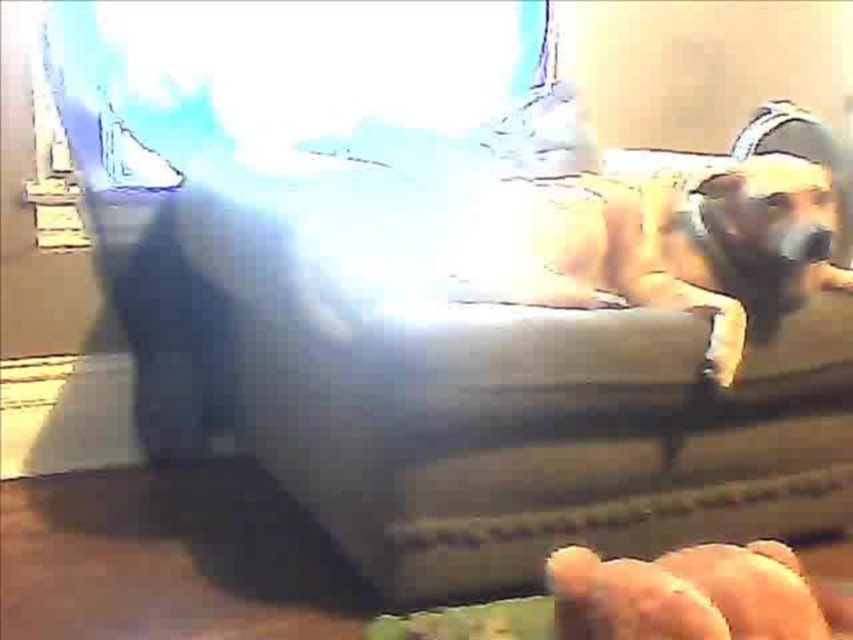
Between furry beige dog at center and smooth leather hand at lower right, which one appears on the right side from the viewer's perspective?

Positioned to the right is furry beige dog at center.

Which is above, furry beige dog at center or smooth leather hand at lower right?

furry beige dog at center

Does point (564, 189) lie behind point (566, 580)?

Yes, it is behind point (566, 580).

Locate an element on the screen. The width and height of the screenshot is (853, 640). furry beige dog at center is located at coordinates pos(666,244).